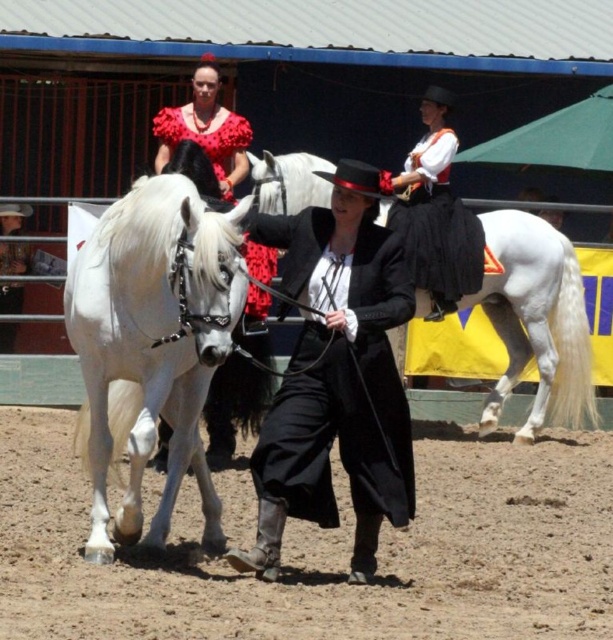
Is brown sandy dirt at lower center above white glossy horse at center?

No.

Which is behind, point (457, 556) or point (498, 275)?

The point (498, 275) is behind.

Is point (425, 564) positioned before point (562, 340)?

Yes, it is in front of point (562, 340).

In order to click on brown sandy dirt at lower center in this screenshot , I will do `click(326, 552)`.

Can you confirm if black matte coat at center is positioned to the left of white glossy horse at center?

Yes, black matte coat at center is to the left of white glossy horse at center.

Between point (386, 392) and point (511, 228), which one is positioned in front?

Point (386, 392)

Does point (371, 186) lie in front of point (268, 168)?

Yes, it is in front of point (268, 168).

Identify the location of black matte coat at center. (335, 376).

Consider the image. Is white glossy horse at center positioned in front of matte black dress at center?

No, white glossy horse at center is further to the viewer.

Between white glossy horse at center and matte black dress at center, which one has less height?

matte black dress at center

Does point (522, 216) come in front of point (218, 410)?

No, (522, 216) is further to viewer.

At what (x,y) coordinates should I click in order to perform the action: click on white glossy horse at center. Please return your answer as a coordinate pair (x, y). The image size is (613, 640). Looking at the image, I should click on (535, 321).